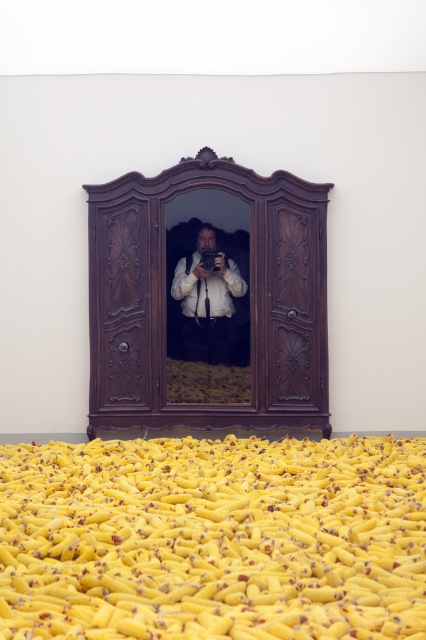
Does yellow matte banana at center come in front of polished dark wood armoire at center?

Yes, yellow matte banana at center is in front of polished dark wood armoire at center.

Is yellow matte banana at center to the right of polished dark wood armoire at center from the viewer's perspective?

Correct, you'll find yellow matte banana at center to the right of polished dark wood armoire at center.

Between point (112, 444) and point (249, 230), which one is positioned in front?

Point (112, 444) is in front.

I want to click on yellow matte banana at center, so click(x=213, y=540).

Is yellow matte banana at center closer to camera compared to white matte shirt at center?

Yes.

Consider the image. Does yellow matte banana at center appear over white matte shirt at center?

Incorrect, yellow matte banana at center is not positioned above white matte shirt at center.

At what (x,y) coordinates should I click in order to perform the action: click on yellow matte banana at center. Please return your answer as a coordinate pair (x, y). Looking at the image, I should click on (213, 540).

This screenshot has width=426, height=640. I want to click on yellow matte banana at center, so click(213, 540).

Is polished dark wood armoire at center shorter than white matte shirt at center?

Incorrect, polished dark wood armoire at center's height does not fall short of white matte shirt at center's.

Who is more distant from viewer, (278, 198) or (175, 337)?

The point (278, 198) is behind.

Find the location of `polished dark wood armoire at center`. polished dark wood armoire at center is located at coordinates (207, 300).